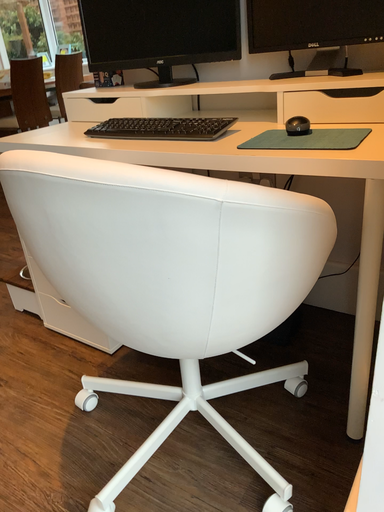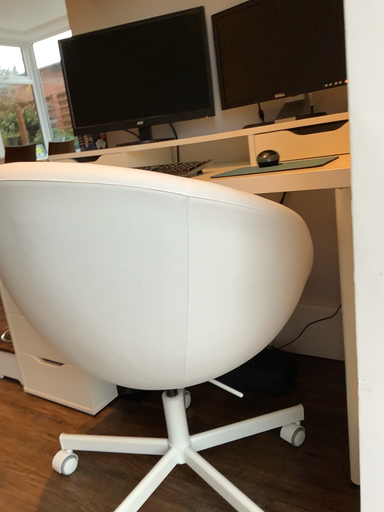
Question: How did the camera likely rotate when shooting the video?

Choices:
 (A) rotated upward
 (B) rotated downward

Answer: (A)